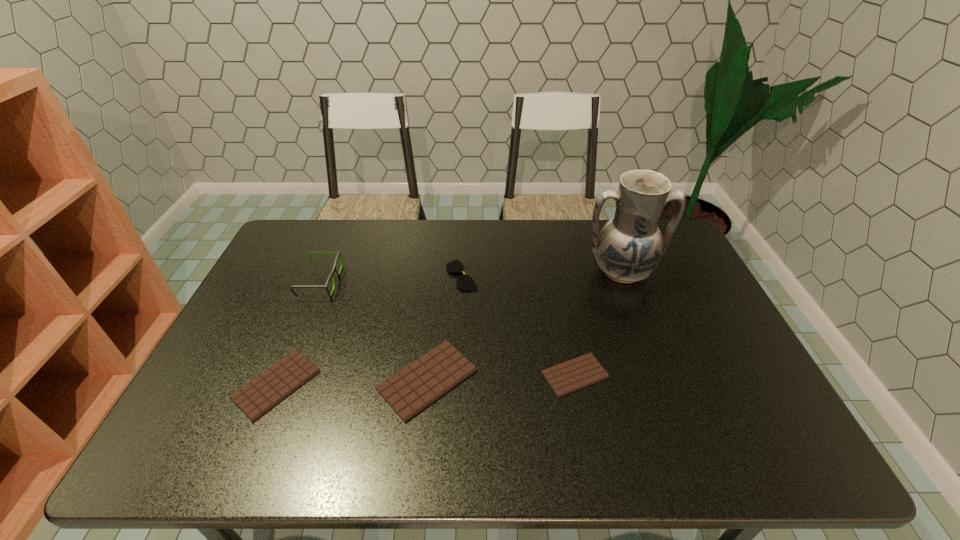
Identify the location of object situated at the near left corner. This screenshot has height=540, width=960. (258, 396).

Where is `object located in the far right corner section of the desktop`? The width and height of the screenshot is (960, 540). object located in the far right corner section of the desktop is located at coordinates (629, 248).

This screenshot has width=960, height=540. I want to click on vacant space at the far edge of the desktop, so click(422, 241).

You are a GUI agent. You are given a task and a screenshot of the screen. Output one action in this format:
    pyautogui.click(x=<x>, y=<y>)
    Task: Click on the vacant space at the near edge of the desktop
    This screenshot has height=540, width=960.
    Given the screenshot: What is the action you would take?
    pyautogui.click(x=340, y=400)

This screenshot has height=540, width=960. In the image, there is a desktop. What are the coordinates of `free space at the left edge` in the screenshot? It's located at (307, 285).

The width and height of the screenshot is (960, 540). I want to click on vacant space at the right edge of the desktop, so click(696, 287).

The image size is (960, 540). Find the location of `vacant space that is in between the taller spectacles and the leftmost chocolate bar`. vacant space that is in between the taller spectacles and the leftmost chocolate bar is located at coordinates (299, 333).

Where is `vacant space that is in between the fifth shortest object and the leftmost chocolate bar`? vacant space that is in between the fifth shortest object and the leftmost chocolate bar is located at coordinates (299, 333).

Locate an element on the screen. The height and width of the screenshot is (540, 960). vacant area between the tallest chocolate bar and the rightmost chocolate bar is located at coordinates (501, 377).

At what (x,y) coordinates should I click in order to perform the action: click on empty space that is in between the pitcher and the tallest chocolate bar. Please return your answer as a coordinate pair (x, y). Looking at the image, I should click on (524, 326).